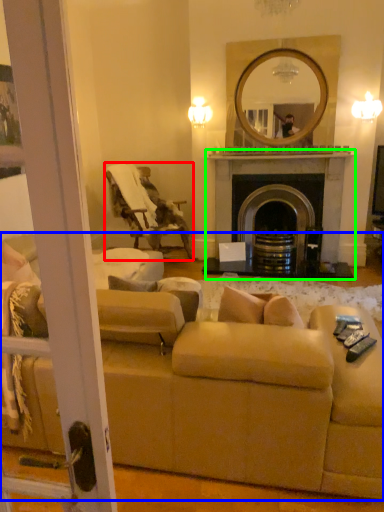
Question: Which object is the farthest from chair (highlighted by a red box)? Choose among these: studio couch (highlighted by a blue box) or fireplace (highlighted by a green box).

Choices:
 (A) studio couch
 (B) fireplace

Answer: (A)